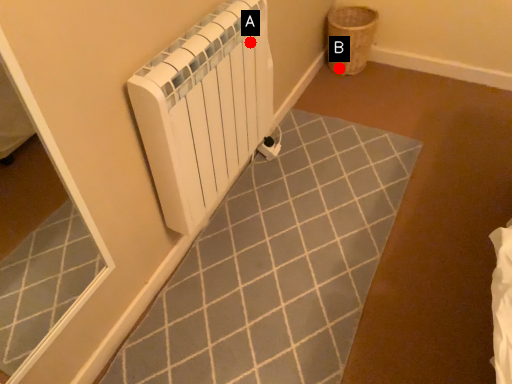
Question: Two points are circled on the image, labeled by A and B beside each circle. Among these points, which one is nearest to the camera?

Choices:
 (A) A is closer
 (B) B is closer

Answer: (A)